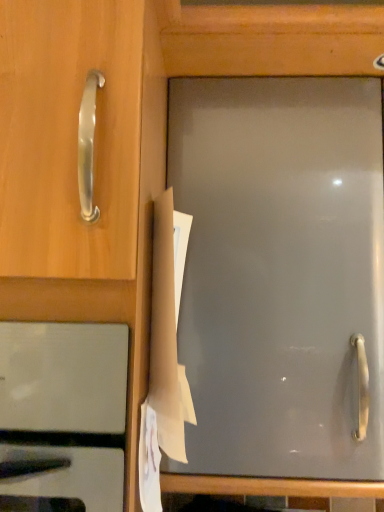
Question: Is there a large distance between brown paper at center and stainless steel oven at lower left?

Choices:
 (A) yes
 (B) no

Answer: (B)

Question: Considering the relative sizes of brown paper at center and stainless steel oven at lower left in the image provided, is brown paper at center thinner than stainless steel oven at lower left?

Choices:
 (A) no
 (B) yes

Answer: (B)

Question: From the image's perspective, would you say brown paper at center is positioned over stainless steel oven at lower left?

Choices:
 (A) yes
 (B) no

Answer: (A)

Question: Could you tell me if brown paper at center is facing stainless steel oven at lower left?

Choices:
 (A) yes
 (B) no

Answer: (B)

Question: Is brown paper at center wider than stainless steel oven at lower left?

Choices:
 (A) yes
 (B) no

Answer: (B)

Question: From a real-world perspective, is brown paper at center physically above stainless steel oven at lower left?

Choices:
 (A) no
 (B) yes

Answer: (B)

Question: From a real-world perspective, is stainless steel oven at lower left positioned under brown paper at center based on gravity?

Choices:
 (A) yes
 (B) no

Answer: (A)

Question: Is stainless steel oven at lower left at the left side of brown paper at center?

Choices:
 (A) no
 (B) yes

Answer: (B)

Question: Is stainless steel oven at lower left thinner than brown paper at center?

Choices:
 (A) no
 (B) yes

Answer: (A)

Question: Is brown paper at center located within stainless steel oven at lower left?

Choices:
 (A) yes
 (B) no

Answer: (B)

Question: Is stainless steel oven at lower left to the right of brown paper at center from the viewer's perspective?

Choices:
 (A) yes
 (B) no

Answer: (B)

Question: Can you confirm if stainless steel oven at lower left is smaller than brown paper at center?

Choices:
 (A) yes
 (B) no

Answer: (B)

Question: Based on their sizes in the image, would you say brown paper at center is bigger or smaller than stainless steel oven at lower left?

Choices:
 (A) small
 (B) big

Answer: (A)